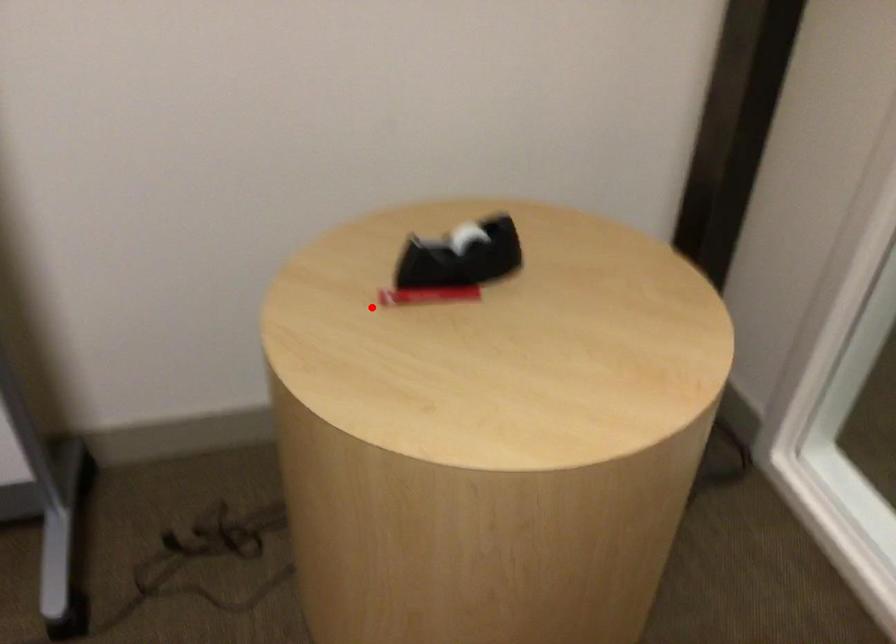
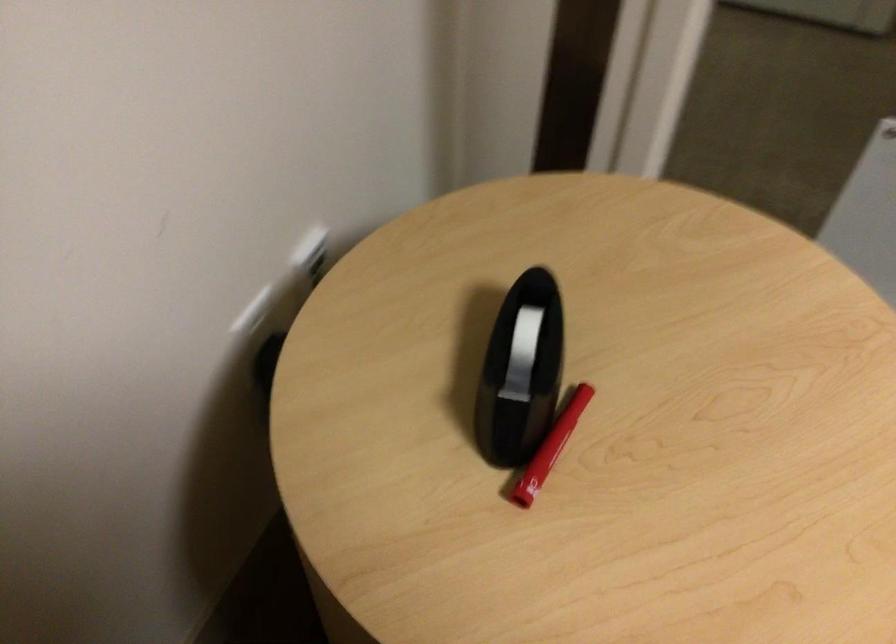
The point at the highlighted location is marked in the first image. Where is the corresponding point in the second image?

(527, 511)